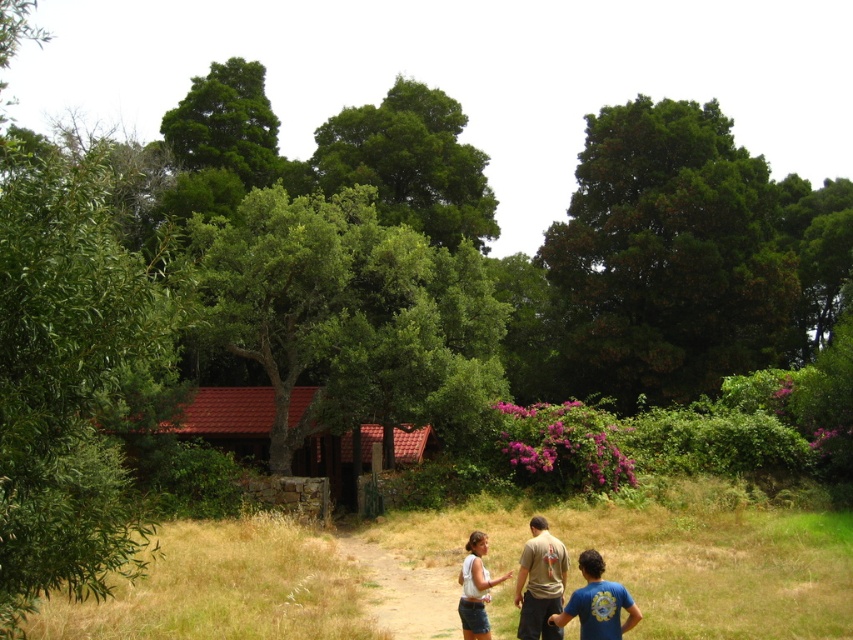
Is the position of green leafy tree at center less distant than that of blue cotton shirt at lower right?

No, it is not.

Does green leafy tree at center have a lesser width compared to blue cotton shirt at lower right?

No, green leafy tree at center is not thinner than blue cotton shirt at lower right.

Who is more forward, [393,186] or [599,589]?

Point [599,589] is in front.

Where is `green leafy tree at center`? green leafy tree at center is located at coordinates click(x=410, y=163).

The height and width of the screenshot is (640, 853). What do you see at coordinates (410, 163) in the screenshot?
I see `green leafy tree at center` at bounding box center [410, 163].

Can you confirm if green leafy tree at center is positioned below white cotton shirt at center?

No.

Between point (425, 99) and point (595, 557), which one is positioned behind?

Point (425, 99)

You are a GUI agent. You are given a task and a screenshot of the screen. Output one action in this format:
    pyautogui.click(x=<x>, y=<y>)
    Task: Click on the green leafy tree at center
    
    Given the screenshot: What is the action you would take?
    pyautogui.click(x=410, y=163)

How far apart are green leafy tree at upper right and denim shorts at lower center?

They are 39.81 meters apart.

Can you confirm if green leafy tree at upper right is thinner than denim shorts at lower center?

No.

Identify the location of green leafy tree at upper right. (666, 257).